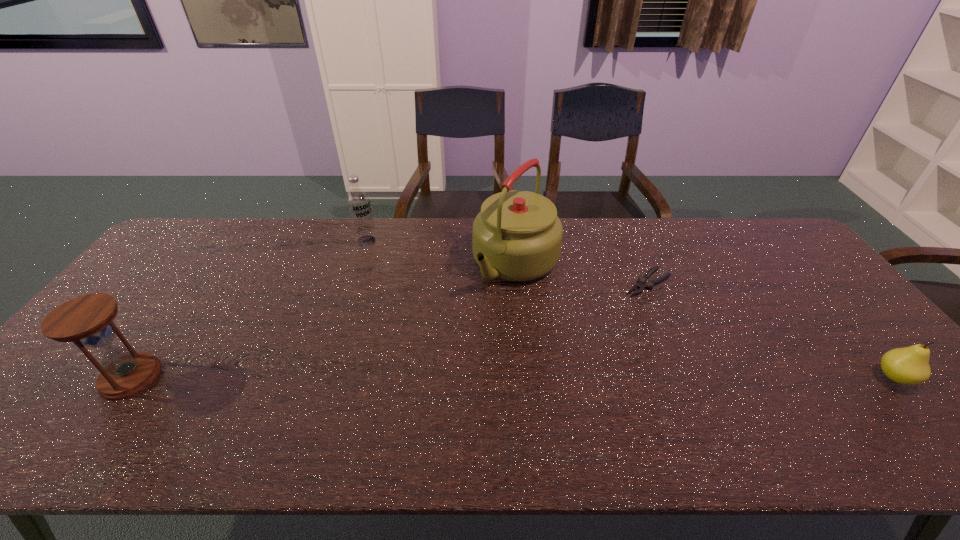
Locate an element on the screen. Image resolution: width=960 pixels, height=540 pixels. vacant spot on the desktop that is between the leftmost object and the fourth tallest object and is positioned at the spout of the tallest object is located at coordinates (414, 377).

The image size is (960, 540). What are the coordinates of `free space on the desktop that is between the hourglass and the pear and is positioned on the front label of the vodka` in the screenshot? It's located at (418, 377).

Locate an element on the screen. The image size is (960, 540). free spot on the desktop that is between the hourglass and the pear and is positioned at the gripping part of the second object from right to left is located at coordinates (513, 377).